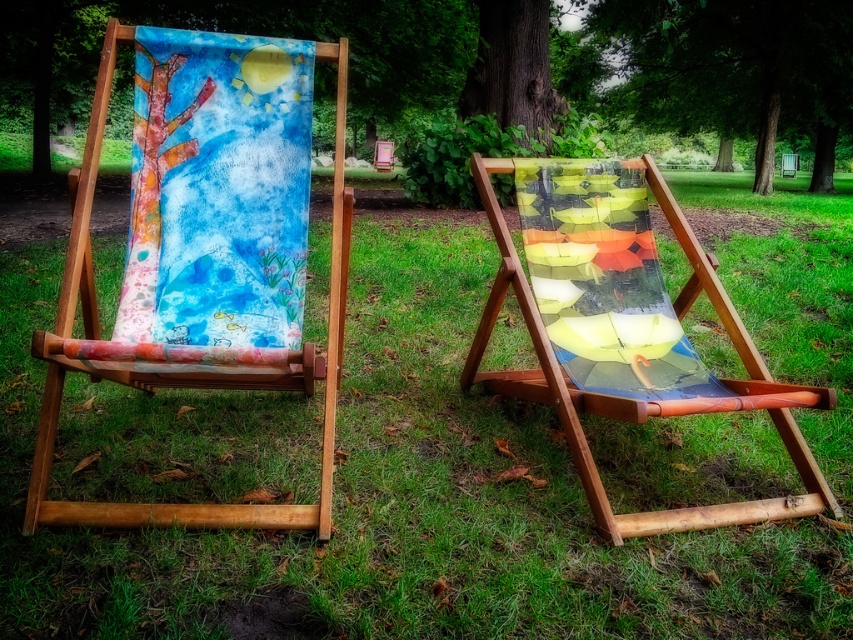
You are an artist planning to paint a landscape scene. You have two objects in your view, the watercolor canvas at upper center and the smooth bark tree at center. Which object should you choose to paint if you want to capture a larger subject?

The watercolor canvas at upper center is larger in size than the smooth bark tree at center, so you should choose the watercolor canvas at upper center to paint the larger subject.

From the picture: You are standing 2 meters away from a point at coordinates point (473,296). If you want to reach that point, how much farther do you need to walk?

The point (473,296) is 3.71 meters away from the viewer. Since you are already 2 meters away, you need to walk an additional 1.71 meters to reach it.